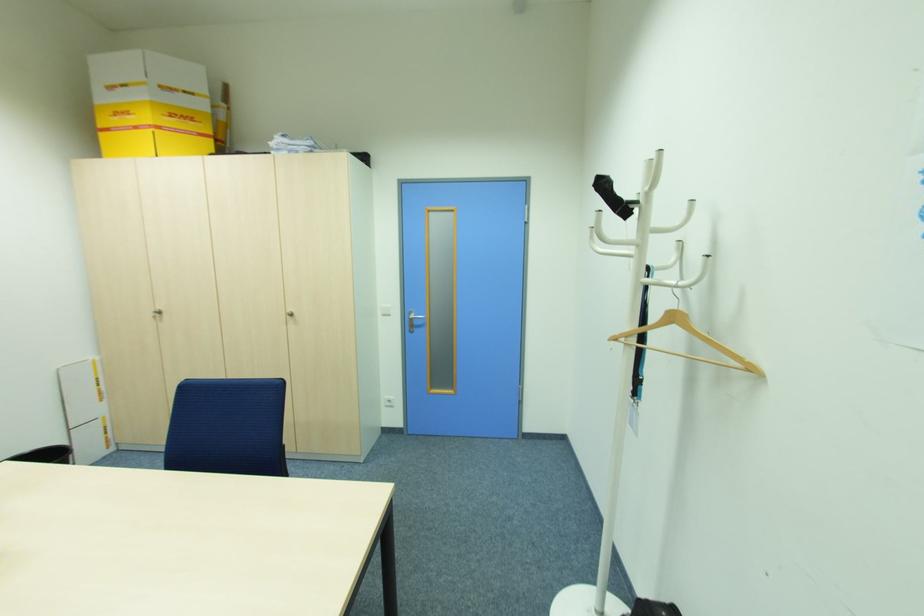
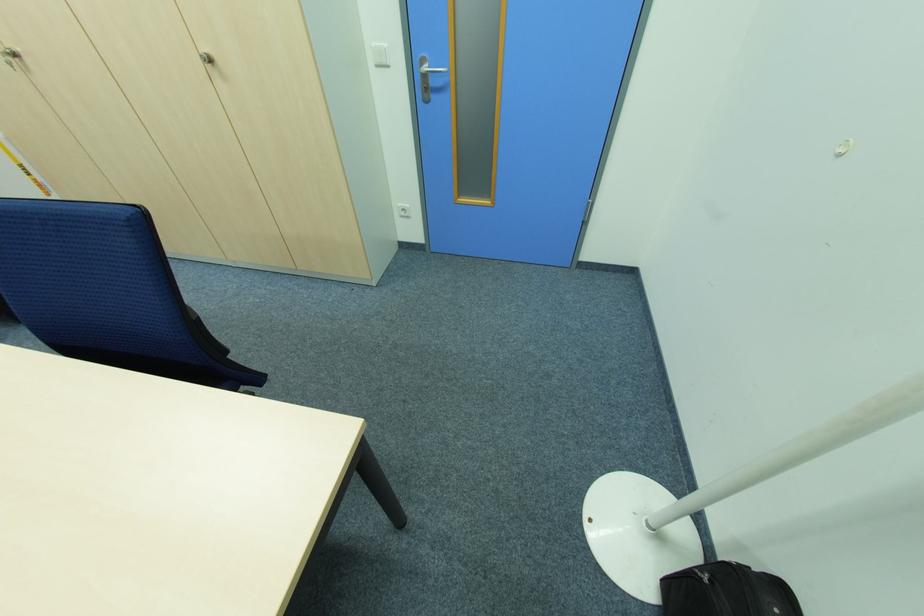
In the second image, find the point that corresponds to point 156,317 in the first image.

(14, 65)